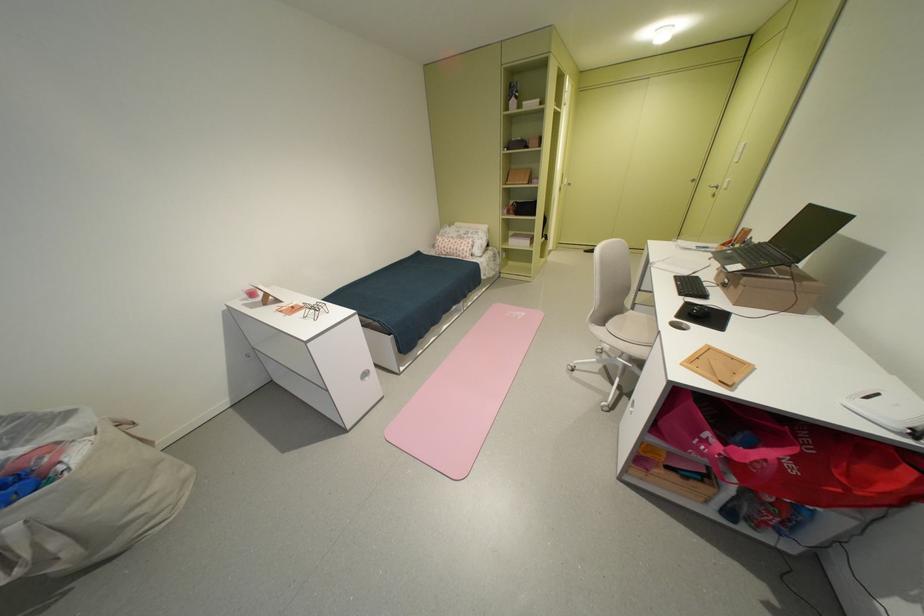
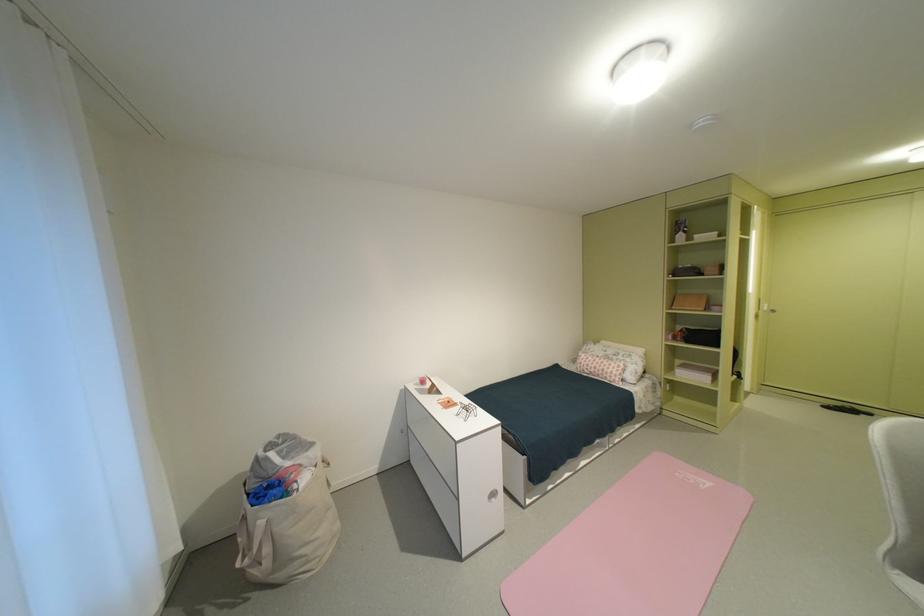
The images are taken continuously from a first-person perspective. In which direction is your viewpoint rotating?

The camera rotated toward left-up.